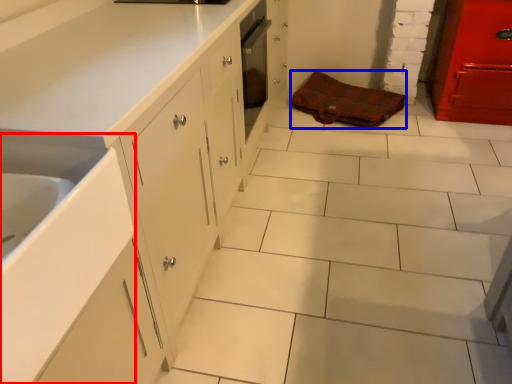
Question: Which of the following is the closest to the observer, sink (highlighted by a red box) or material (highlighted by a blue box)?

Choices:
 (A) sink
 (B) material

Answer: (A)